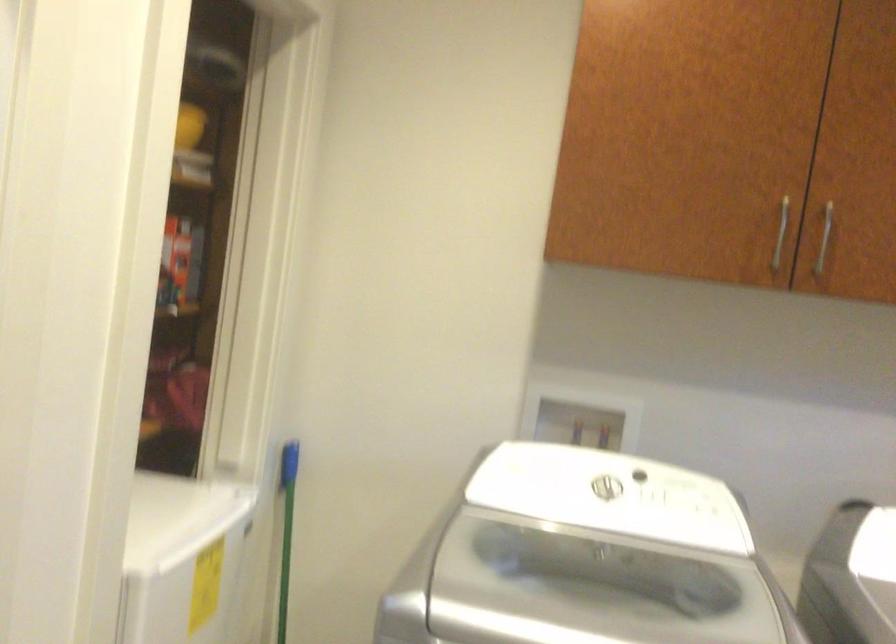
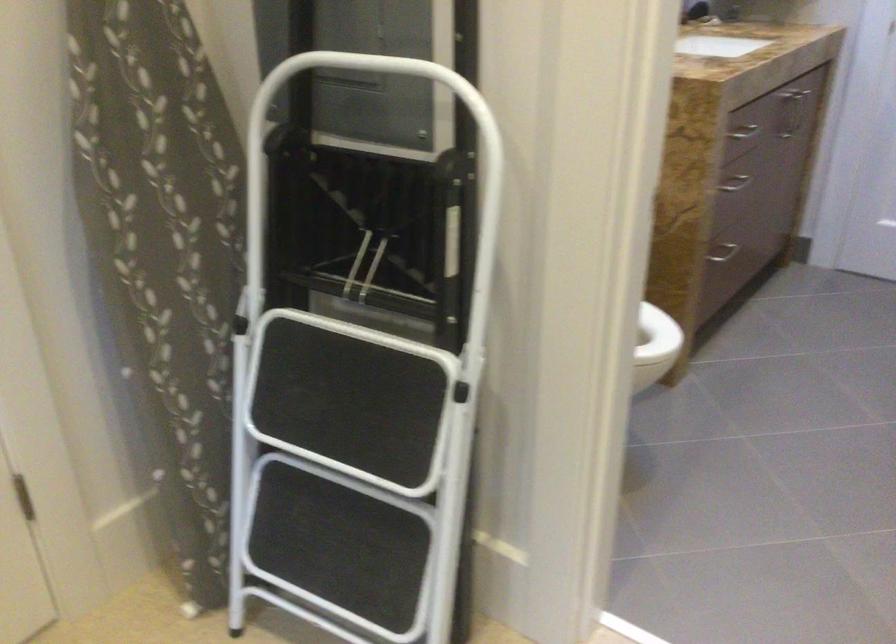
Based on the continuous images, in which direction is the camera rotating?

The rotation direction of the camera is left-down.